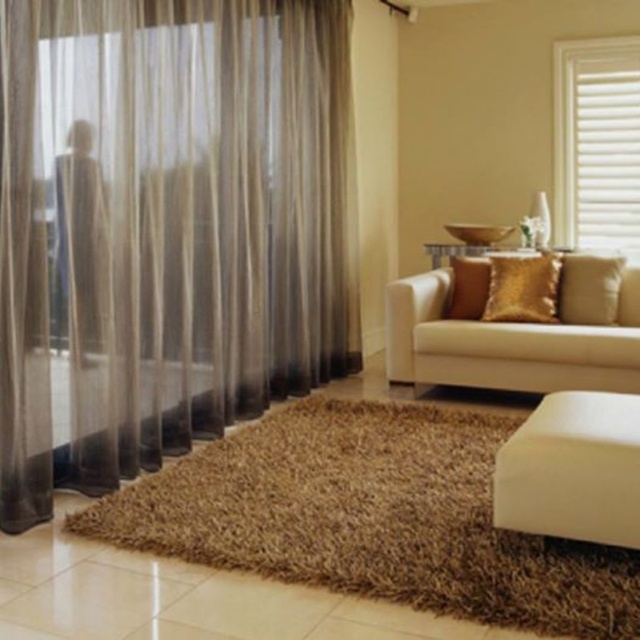
You are standing in the living room and want to know which of the two points, point (484,380) or point (444,316), is closer to you. Can you determine this based on the scene?

Point (484,380) is closer to the camera than point (444,316), so it is closer to you.

You are arranging a small party in the living room and need to place a 1.5 meter long table. The beige fabric couch at center and the gold shiny pillow at center are in the way. Which object should you move to make space for the table?

The beige fabric couch at center is larger in size than the gold shiny pillow at center, so you should move the beige fabric couch at center to make space for the table since it takes up more room.